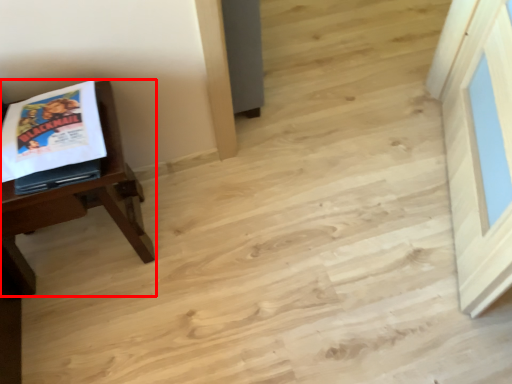
Question: In this image, where is table (annotated by the red box) located relative to comic book?

Choices:
 (A) left
 (B) right

Answer: (A)